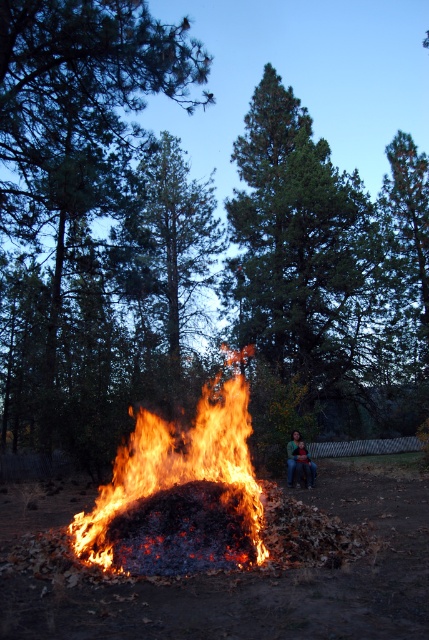
Question: Observing the image, what is the correct spatial positioning of flaming wood at center in reference to green knitted sweater at center?

Choices:
 (A) below
 (B) above

Answer: (B)

Question: Is the position of flaming wood at center more distant than that of green knitted sweater at center?

Choices:
 (A) no
 (B) yes

Answer: (A)

Question: Where is flaming wood at center located in relation to green knitted sweater at center in the image?

Choices:
 (A) above
 (B) below

Answer: (A)

Question: Which point is farther from the camera taking this photo?

Choices:
 (A) (293, 456)
 (B) (224, 429)

Answer: (A)